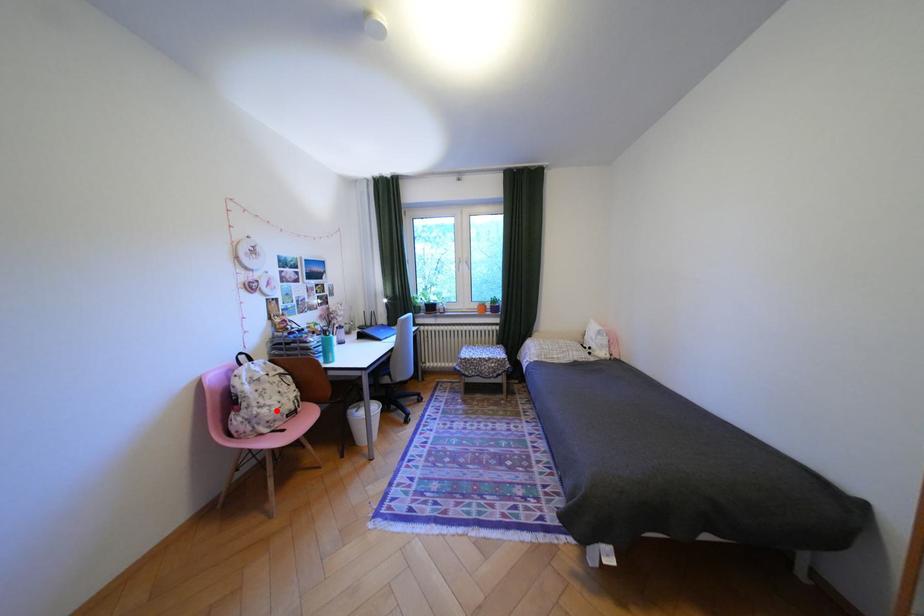
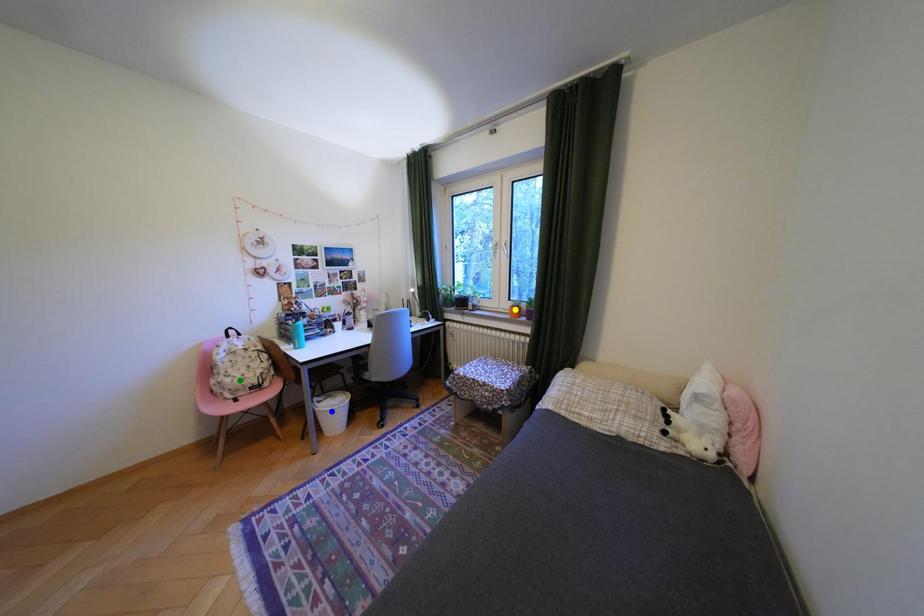
Question: I am providing you with two images of the same scene from different viewpoints. A red point is marked on the first image. You are given multiple points on the second image. In image 2, which mark is for the same physical point as the one in image 1?

Choices:
 (A) green point
 (B) yellow point
 (C) blue point

Answer: (A)